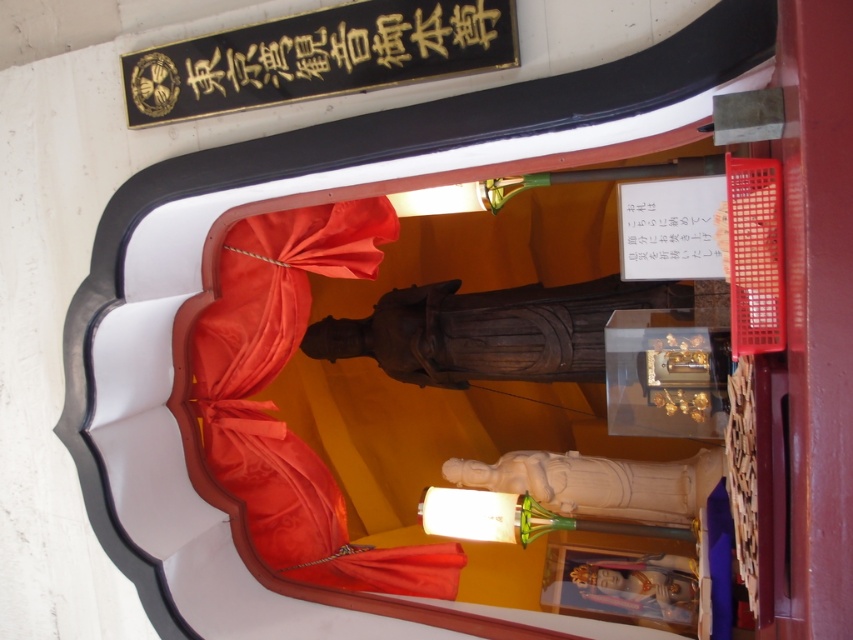
Is matte red fabric at center bigger than goldmaterial/texturesign at upper center?

Correct, matte red fabric at center is larger in size than goldmaterial/texturesign at upper center.

Is matte red fabric at center closer to camera compared to goldmaterial/texturesign at upper center?

No.

Who is more distant from viewer, [318,570] or [405,4]?

The point [318,570] is behind.

Image resolution: width=853 pixels, height=640 pixels. In order to click on matte red fabric at center in this screenshot , I will do 276,406.